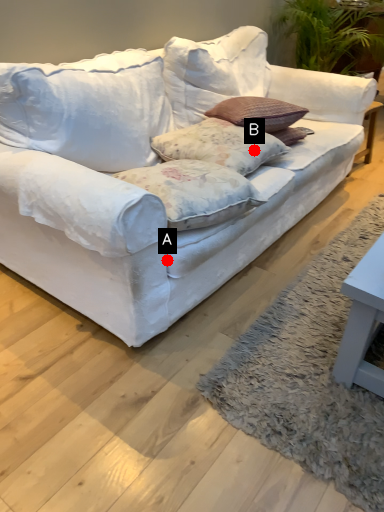
Question: Two points are circled on the image, labeled by A and B beside each circle. Among these points, which one is farthest from the camera?

Choices:
 (A) A is further
 (B) B is further

Answer: (B)